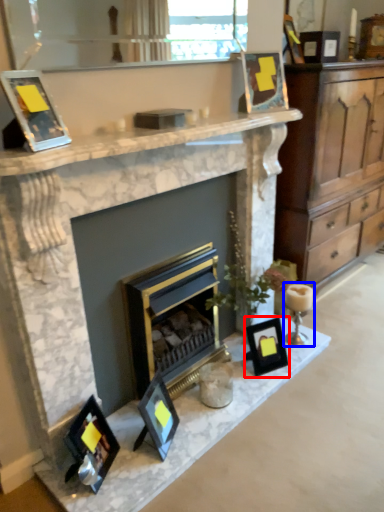
Question: Among these objects, which one is nearest to the camera, picture frame (highlighted by a red box) or candle holder (highlighted by a blue box)?

Choices:
 (A) picture frame
 (B) candle holder

Answer: (A)